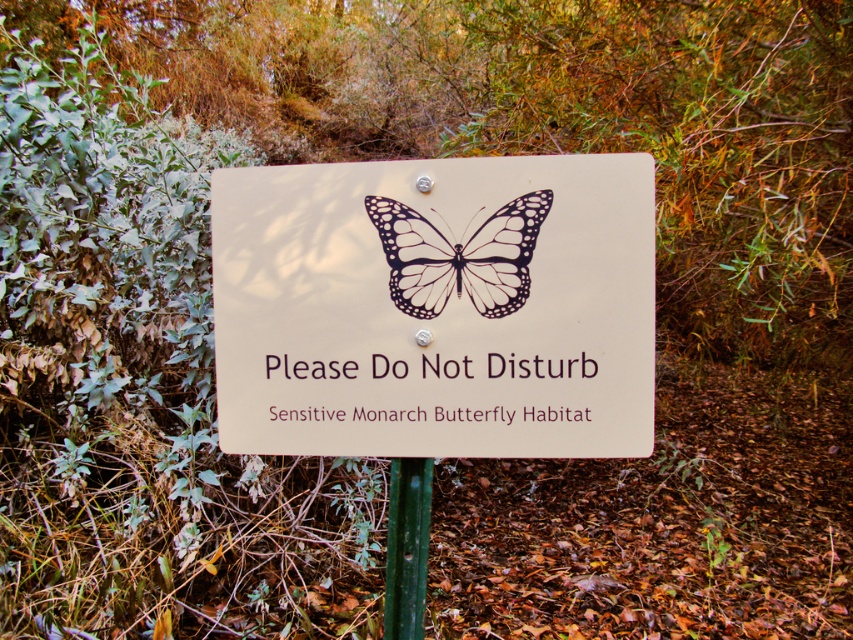
You are a conservationist measuring the dimensions of the sign. You notice the black matte butterfly at center and the green metallic pole at center. Which object has a greater width according to the sign?

The black matte butterfly at center has a greater width than the green metallic pole at center.

You are a park ranger checking the sign in the forest. You notice the black matte butterfly at center and the green metallic pole at center. Which object is positioned to the right side from your viewpoint?

The black matte butterfly at center is positioned to the right of the green metallic pole at center.

You are a park ranger checking the distance between the beige plastic sign at center and the green metallic pole at center. According to the guidelines, the sign must be at least 12 inches away from the pole to prevent damage from weathering. Is the current placement compliant?

The beige plastic sign at center is 12.79 inches away from the green metallic pole at center, which exceeds the required 12 inches, so the current placement is compliant with the guidelines.